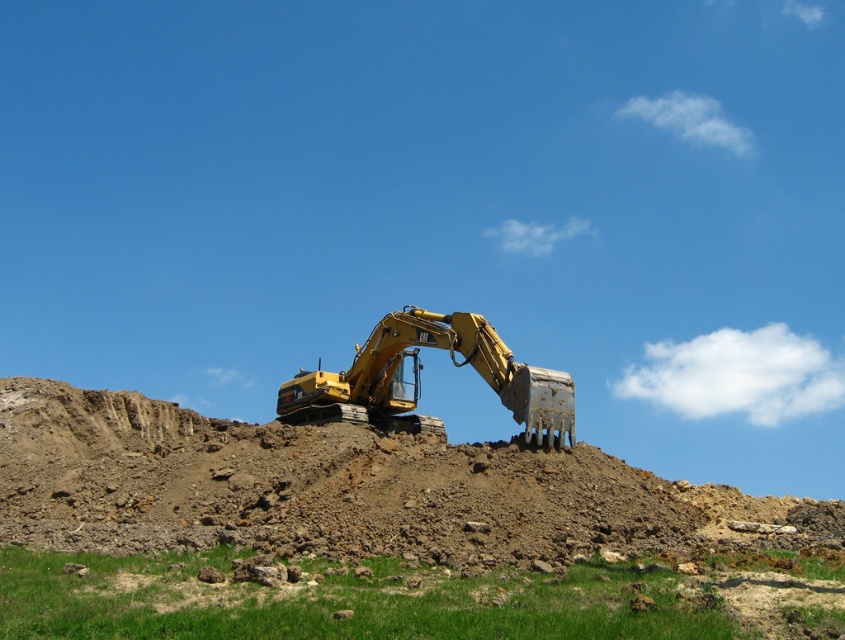
Is brown dirt hill at center bigger than green grass at lower center?

Correct, brown dirt hill at center is larger in size than green grass at lower center.

Which is behind, point (366, 544) or point (726, 566)?

Point (366, 544)

This screenshot has height=640, width=845. Identify the location of brown dirt hill at center. (341, 486).

Describe the element at coordinates (350, 602) in the screenshot. I see `green grass at lower center` at that location.

Between green grass at lower center and matte yellow excavator at center, which one appears on the left side from the viewer's perspective?

matte yellow excavator at center is more to the left.

Find the location of a particular element. green grass at lower center is located at coordinates (350, 602).

Based on the photo, is brown dirt hill at center wider than matte yellow excavator at center?

Correct, the width of brown dirt hill at center exceeds that of matte yellow excavator at center.

Which is above, brown dirt hill at center or matte yellow excavator at center?

matte yellow excavator at center is higher up.

This screenshot has width=845, height=640. I want to click on brown dirt hill at center, so click(x=341, y=486).

Find the location of a particular element. Image resolution: width=845 pixels, height=640 pixels. brown dirt hill at center is located at coordinates (341, 486).